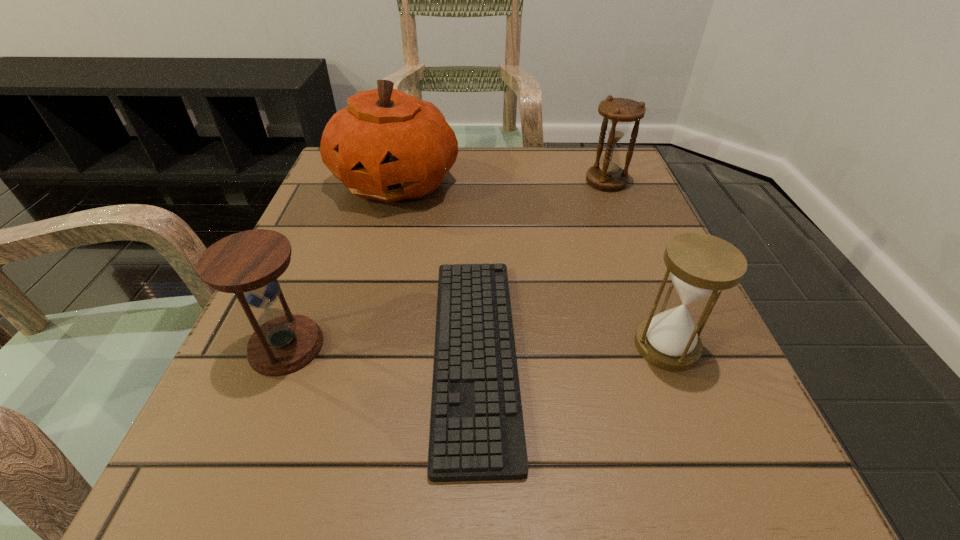
The height and width of the screenshot is (540, 960). I want to click on vacant region at the near right corner of the desktop, so click(x=792, y=502).

The height and width of the screenshot is (540, 960). I want to click on vacant area that lies between the tallest object and the leftmost hourglass, so click(341, 264).

Where is `vacant area that lies between the pumpkin and the leftmost hourglass`? The height and width of the screenshot is (540, 960). vacant area that lies between the pumpkin and the leftmost hourglass is located at coordinates (341, 264).

This screenshot has height=540, width=960. Identify the location of unoccupied area between the farthest hourglass and the tallest object. (501, 181).

Point out which object is positioned as the fourth nearest to the farthest hourglass. Please provide its 2D coordinates. Your answer should be formatted as a tuple, i.e. [(x, y)], where the tuple contains the x and y coordinates of a point satisfying the conditions above.

[(248, 263)]

Select which object appears as the second closest to the pumpkin. Please provide its 2D coordinates. Your answer should be formatted as a tuple, i.e. [(x, y)], where the tuple contains the x and y coordinates of a point satisfying the conditions above.

[(248, 263)]

Where is `hourglass identified as the closest to the pumpkin`? This screenshot has width=960, height=540. hourglass identified as the closest to the pumpkin is located at coordinates (248, 263).

Choose which hourglass is the nearest neighbor to the leftmost hourglass. Please provide its 2D coordinates. Your answer should be formatted as a tuple, i.e. [(x, y)], where the tuple contains the x and y coordinates of a point satisfying the conditions above.

[(701, 265)]

At what (x,y) coordinates should I click in order to perform the action: click on vacant region that satisfies the following two spatial constraints: 1. on the front-facing side of the computer keyboard; 2. on the right side of the tallest object. Please return your answer as a coordinate pair (x, y). Looking at the image, I should click on (350, 354).

The image size is (960, 540). Identify the location of free space in the image that satisfies the following two spatial constraints: 1. on the front-facing side of the tallest object; 2. on the left side of the farthest hourglass. (396, 181).